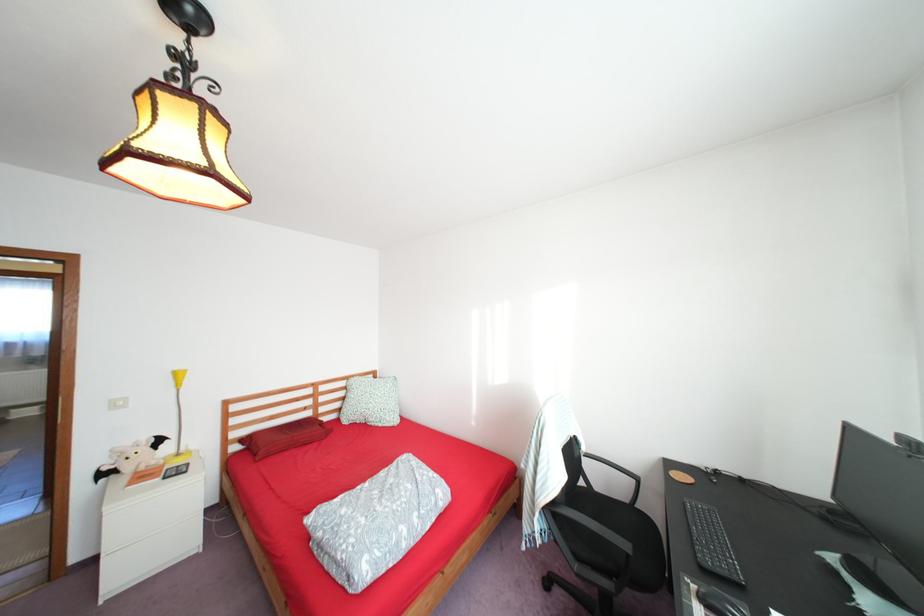
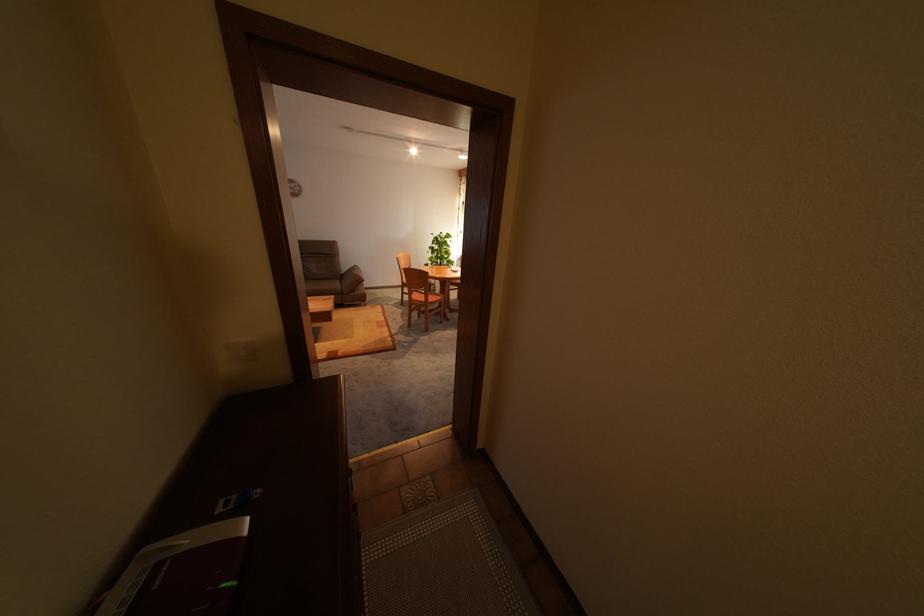
Question: I am providing you with two images of the same scene from different viewpoints. Which of the following objects are not visible in image2?

Choices:
 (A) silver faucet lever
 (B) small blue object
 (C) wooden chair sitting surface
 (D) folded patterned blanket

Answer: (D)